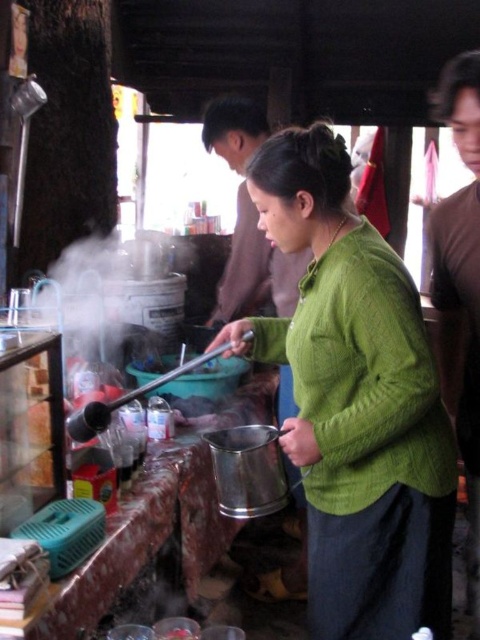
Question: Can you confirm if green knitted sweater at center is smaller than brown cotton shirt at upper right?

Choices:
 (A) yes
 (B) no

Answer: (B)

Question: Observing the image, what is the correct spatial positioning of green knitted sweater at center in reference to brown cotton shirt at upper right?

Choices:
 (A) left
 (B) right

Answer: (A)

Question: Is green knitted sweater at center positioned before brown cotton shirt at upper right?

Choices:
 (A) yes
 (B) no

Answer: (A)